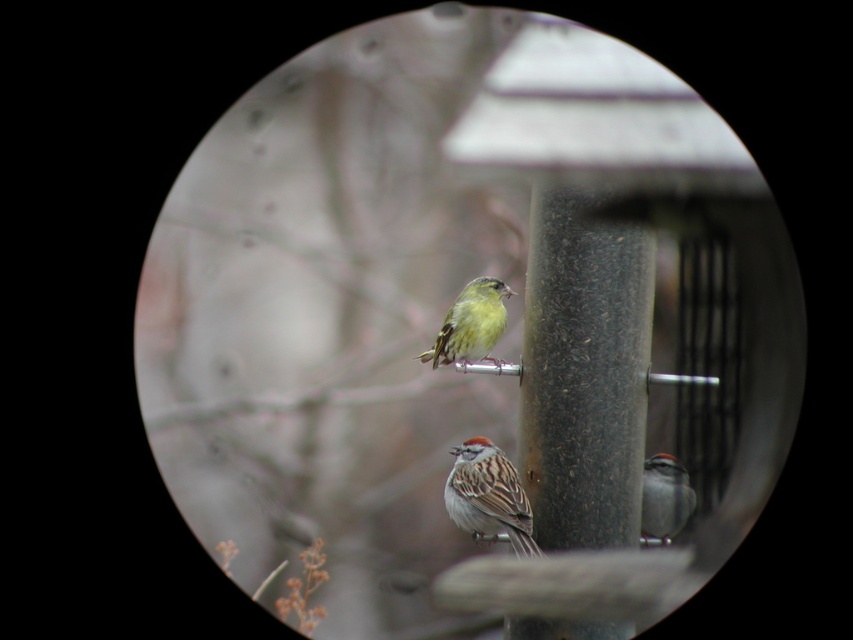
Can you confirm if yellow-green textured bird at center is taller than gray matte sparrow at lower right?

Yes.

Between yellow-green textured bird at center and gray matte sparrow at lower right, which one appears on the right side from the viewer's perspective?

From the viewer's perspective, gray matte sparrow at lower right appears more on the right side.

Find the location of a particular element. yellow-green textured bird at center is located at coordinates (471, 324).

Does brown speckled sparrow at lower center appear on the right side of gray matte sparrow at lower right?

In fact, brown speckled sparrow at lower center is to the left of gray matte sparrow at lower right.

Who is taller, brown speckled sparrow at lower center or gray matte sparrow at lower right?

brown speckled sparrow at lower center is taller.

Is point (492, 461) positioned before point (663, 476)?

Yes, point (492, 461) is closer to viewer.

I want to click on brown speckled sparrow at lower center, so click(488, 496).

Is brown speckled sparrow at lower center closer to the viewer compared to yellow-green textured bird at center?

Yes, it is.

In order to click on brown speckled sparrow at lower center in this screenshot , I will do `click(488, 496)`.

This screenshot has height=640, width=853. What are the coordinates of `brown speckled sparrow at lower center` in the screenshot? It's located at (488, 496).